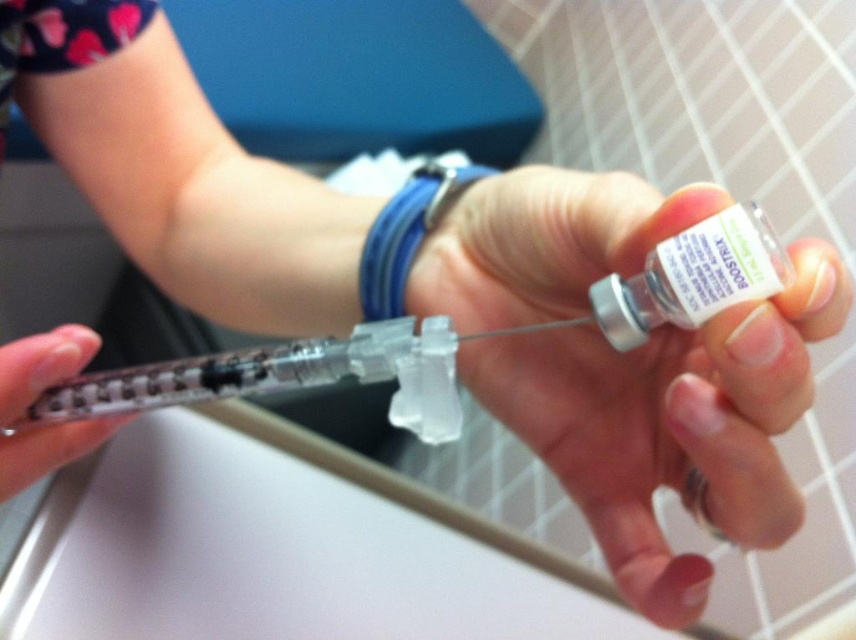
You are a nurse preparing to administer a vaccine. You notice a transparent plastic syringe at center and a blue rubber band at center on the table. Which object is positioned lower?

The transparent plastic syringe at center is below the blue rubber band at center, so the syringe is positioned lower.

You are a nurse preparing to administer a vaccine. You have a clear plastic vial at center and a blue rubber band at center on the table. The syringe needs to be within 5 inches to safely draw medication. Can you safely draw medication from the vial using the syringe?

The clear plastic vial at center and blue rubber band at center are 5.12 inches apart. Since the required distance is 5 inches, the syringe is slightly too far to safely draw medication from the vial.

From the picture: You are a nurse preparing to administer a vaccine. You have a transparent plastic syringe at center and a blue rubber band at center in your workspace. The syringe needs to be within 6 inches of the rubber band to secure it properly. Can you confirm if the syringe is close enough?

The distance between the transparent plastic syringe at center and the blue rubber band at center is 5.65 inches, which is within the required 6 inches. Therefore, the syringe is close enough to be secured properly with the rubber band.